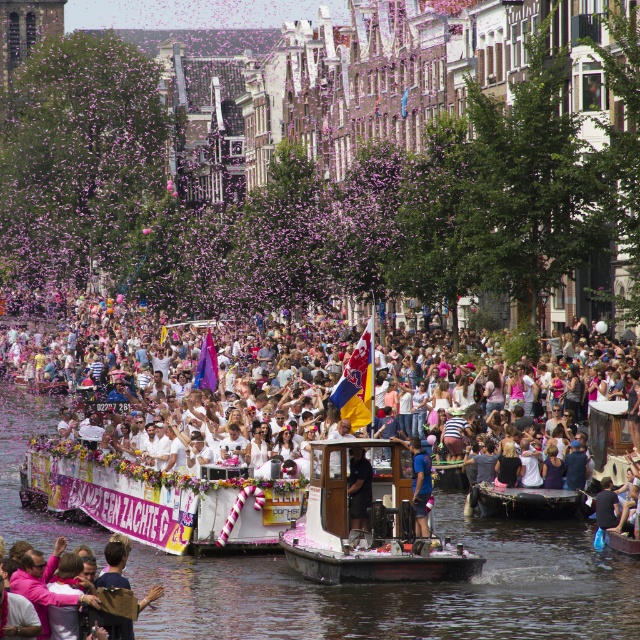
Question: Does pink fabric at lower left have a greater width compared to black fabric person at center?

Choices:
 (A) no
 (B) yes

Answer: (B)

Question: Is black rubber boat at lower center to the right of blue fabric at center from the viewer's perspective?

Choices:
 (A) yes
 (B) no

Answer: (A)

Question: Estimate the real-world distances between objects in this image. Which object is farther from the wooden boat at center?

Choices:
 (A) transparent plastic boat at center
 (B) black fabric person at center

Answer: (A)

Question: Can you confirm if transparent plastic boat at center is positioned to the right of black fabric person at center?

Choices:
 (A) no
 (B) yes

Answer: (A)

Question: Which object appears farthest from the camera in this image?

Choices:
 (A) black fabric person at center
 (B) transparent plastic boat at center
 (C) blue fabric at center
 (D) white cotton crowd at center

Answer: (D)

Question: Among these objects, which one is nearest to the camera?

Choices:
 (A) transparent plastic boat at center
 (B) black fabric person at center
 (C) pink fabric at lower left

Answer: (C)